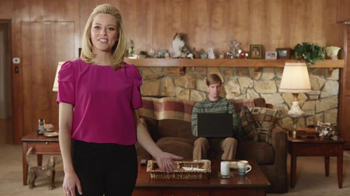
Where is `picture frames`? picture frames is located at coordinates (272, 52), (283, 52), (254, 52).